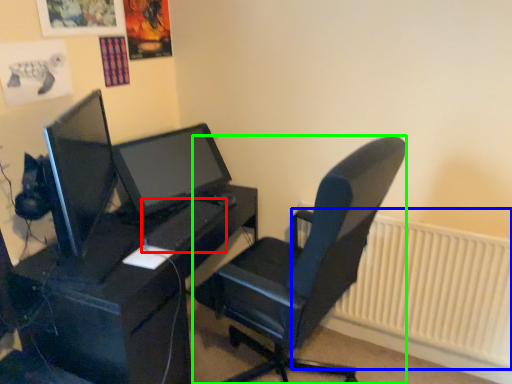
Question: Which object is positioned closest to keyboard (highlighted by a red box)? Select from radiator (highlighted by a blue box) and chair (highlighted by a green box).

Choices:
 (A) radiator
 (B) chair

Answer: (B)